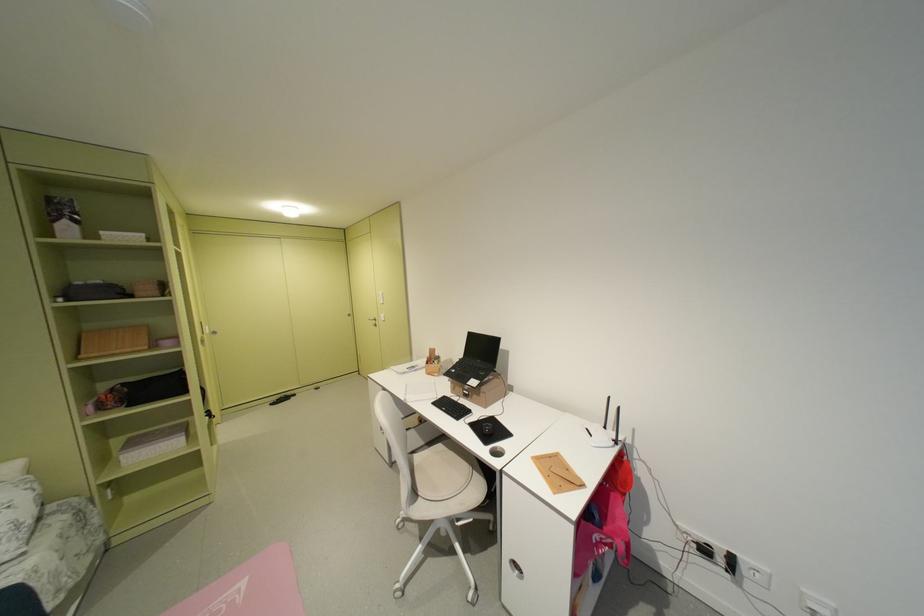
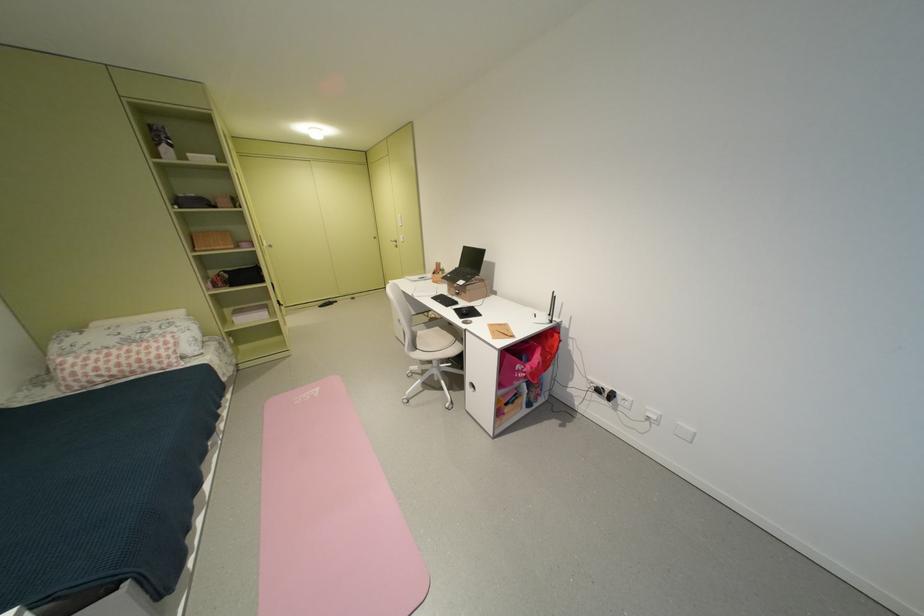
Locate, in the second image, the point that corresponds to (x=612, y=553) in the first image.

(530, 376)